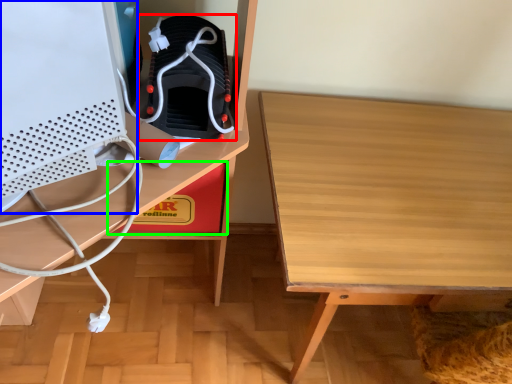
Question: Estimate the real-world distances between objects in this image. Which object is farther from footwear (highlighted by a red box), desktop computer (highlighted by a blue box) or cardboard box (highlighted by a green box)?

Choices:
 (A) desktop computer
 (B) cardboard box

Answer: (B)